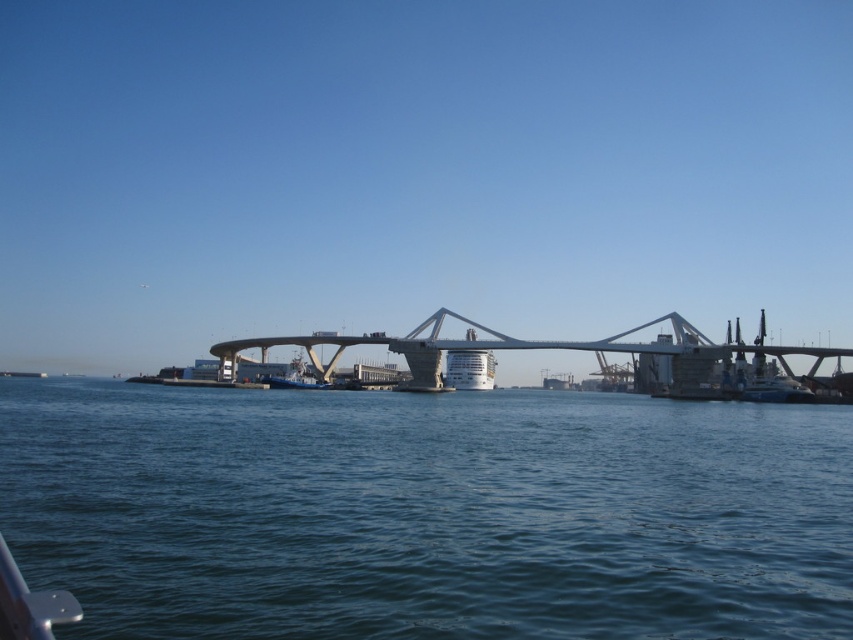
Can you confirm if blue water at center is shorter than white concrete bridge at center?

Correct, blue water at center is not as tall as white concrete bridge at center.

Which is behind, point (372, 602) or point (718, 348)?

The point (718, 348) is more distant.

What are the coordinates of `blue water at center` in the screenshot? It's located at (426, 513).